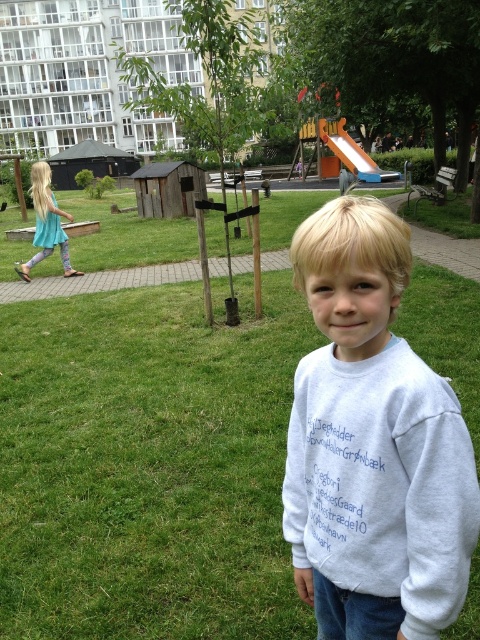
Question: Which point is farther to the camera?

Choices:
 (A) (360, 531)
 (B) (49, 193)
 (C) (152, 392)

Answer: (B)

Question: Can you confirm if white cotton sweatshirt at center is bigger than turquoise fabric dress at left?

Choices:
 (A) no
 (B) yes

Answer: (A)

Question: Among these objects, which one is nearest to the camera?

Choices:
 (A) green grass at center
 (B) turquoise fabric dress at left
 (C) white cotton sweatshirt at center

Answer: (C)

Question: Which point is farther to the camera?

Choices:
 (A) (233, 540)
 (B) (54, 232)

Answer: (B)

Question: Is green grass at center smaller than turquoise fabric dress at left?

Choices:
 (A) no
 (B) yes

Answer: (B)

Question: Is white cotton sweatshirt at center smaller than turquoise fabric dress at left?

Choices:
 (A) no
 (B) yes

Answer: (B)